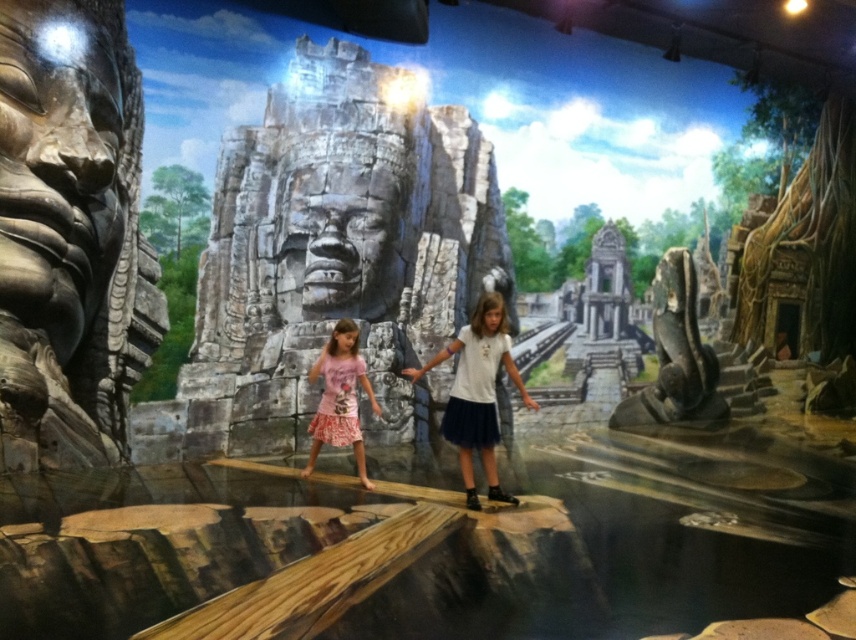
Does white tulle skirt at center come in front of pink floral dress at center?

Yes, white tulle skirt at center is closer to the viewer.

Based on the photo, between white tulle skirt at center and pink floral dress at center, which one is positioned higher?

white tulle skirt at center

Is point (479, 502) positioned in front of point (308, 472)?

That is True.

I want to click on white tulle skirt at center, so click(x=477, y=392).

Does rusty stone statue at right appear on the right side of white tulle skirt at center?

Indeed, rusty stone statue at right is positioned on the right side of white tulle skirt at center.

What do you see at coordinates (675, 355) in the screenshot? I see `rusty stone statue at right` at bounding box center [675, 355].

This screenshot has width=856, height=640. I want to click on rusty stone statue at right, so click(x=675, y=355).

What do you see at coordinates (339, 252) in the screenshot?
I see `gray stone face at center` at bounding box center [339, 252].

Who is lower down, gray stone face at center or rusty stone statue at right?

rusty stone statue at right is lower down.

Which is behind, point (403, 362) or point (690, 278)?

Positioned behind is point (690, 278).

What are the coordinates of `gray stone face at center` in the screenshot? It's located at (339, 252).